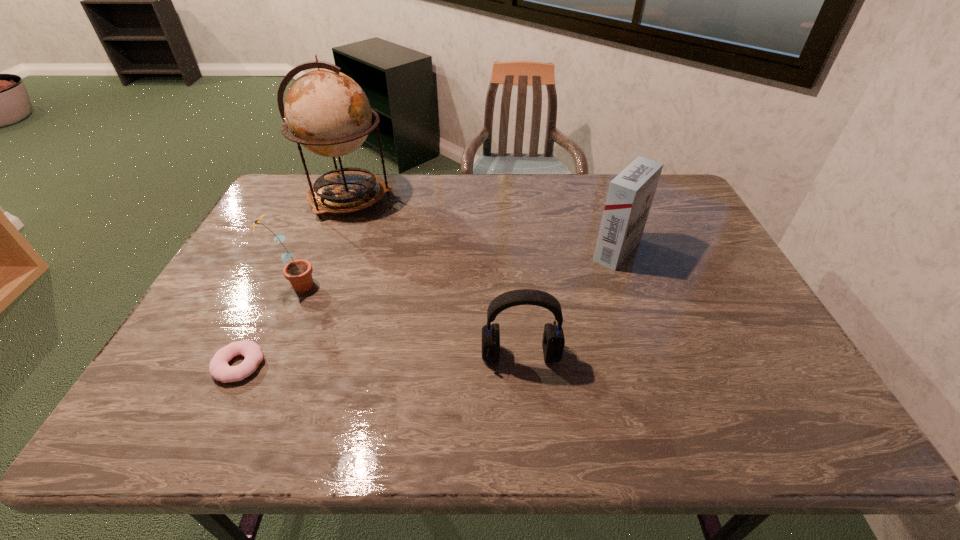
At what (x,y) coordinates should I click in order to perform the action: click on free space at the right edge of the desktop. Please return your answer as a coordinate pair (x, y). This screenshot has width=960, height=540. Looking at the image, I should click on (751, 325).

At what (x,y) coordinates should I click in order to perform the action: click on free location at the far left corner. Please return your answer as a coordinate pair (x, y). This screenshot has width=960, height=540. Looking at the image, I should click on (306, 181).

The height and width of the screenshot is (540, 960). I want to click on blank space at the near right corner, so click(x=824, y=418).

This screenshot has height=540, width=960. Find the location of `free space between the sunflower and the farthest object`. free space between the sunflower and the farthest object is located at coordinates (323, 242).

Image resolution: width=960 pixels, height=540 pixels. Find the location of `free space between the third farthest object and the tallest object`. free space between the third farthest object and the tallest object is located at coordinates (323, 242).

Find the location of a particular element. Image resolution: width=960 pixels, height=540 pixels. vacant space that is in between the doughnut and the second object from right to left is located at coordinates (380, 360).

The height and width of the screenshot is (540, 960). I want to click on free space that is in between the third nearest object and the headset, so click(x=408, y=320).

Identify the location of free point between the headset and the rightmost object. The height and width of the screenshot is (540, 960). pyautogui.click(x=569, y=303).

You are a GUI agent. You are given a task and a screenshot of the screen. Output one action in this format:
    pyautogui.click(x=<x>, y=<y>)
    Task: Click on the blank region between the sunflower and the fourth tallest object
    The width and height of the screenshot is (960, 540).
    Given the screenshot: What is the action you would take?
    pyautogui.click(x=408, y=320)

Locate an element on the screen. The height and width of the screenshot is (540, 960). empty space that is in between the second farthest object and the second object from right to left is located at coordinates (569, 303).